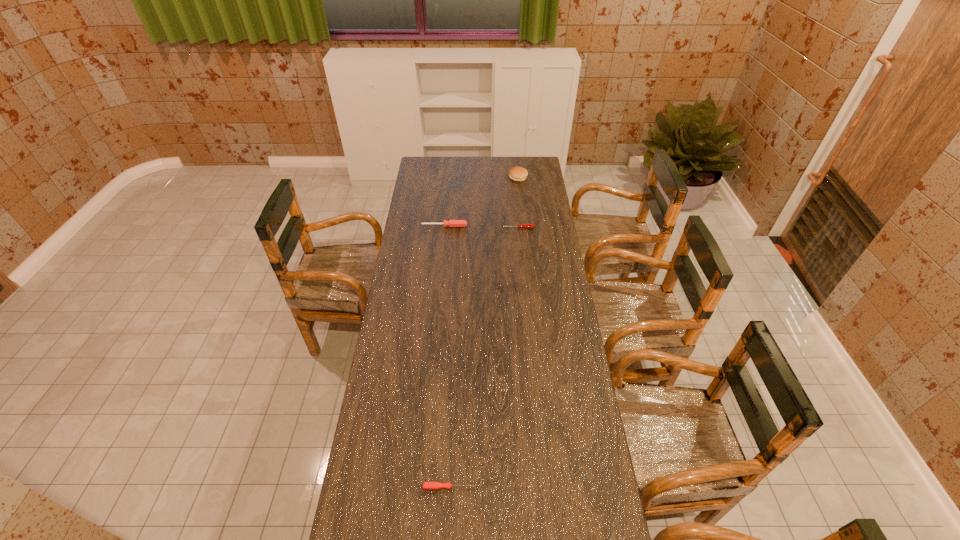
Locate an element on the screen. This screenshot has width=960, height=540. the farthest object is located at coordinates [x=516, y=173].

Where is `the tallest object`? the tallest object is located at coordinates (516, 173).

Locate an element on the screen. Image resolution: width=960 pixels, height=540 pixels. the tallest screwdriver is located at coordinates (451, 223).

Identify the location of the second shortest screwdriver. Image resolution: width=960 pixels, height=540 pixels. (528, 226).

Identify the location of the third tallest object. Image resolution: width=960 pixels, height=540 pixels. (528, 226).

Where is `the shortest object`? The width and height of the screenshot is (960, 540). the shortest object is located at coordinates (426, 485).

At what (x,y) coordinates should I click in order to perform the action: click on the nearest screwdriver. Please return your answer as a coordinate pair (x, y). Looking at the image, I should click on (426, 485).

Locate an element on the screen. The image size is (960, 540). free space located 0.330m on the front of the farthest object is located at coordinates (522, 217).

Find the location of a particular element. Image resolution: width=960 pixels, height=540 pixels. vacant space located on the back of the tallest screwdriver is located at coordinates [445, 216].

You are a GUI agent. You are given a task and a screenshot of the screen. Output one action in this format:
    pyautogui.click(x=<x>, y=<y>)
    Task: Click on the vacant space located 0.260m on the front of the third tallest object
    The width and height of the screenshot is (960, 540).
    Given the screenshot: What is the action you would take?
    pyautogui.click(x=521, y=265)